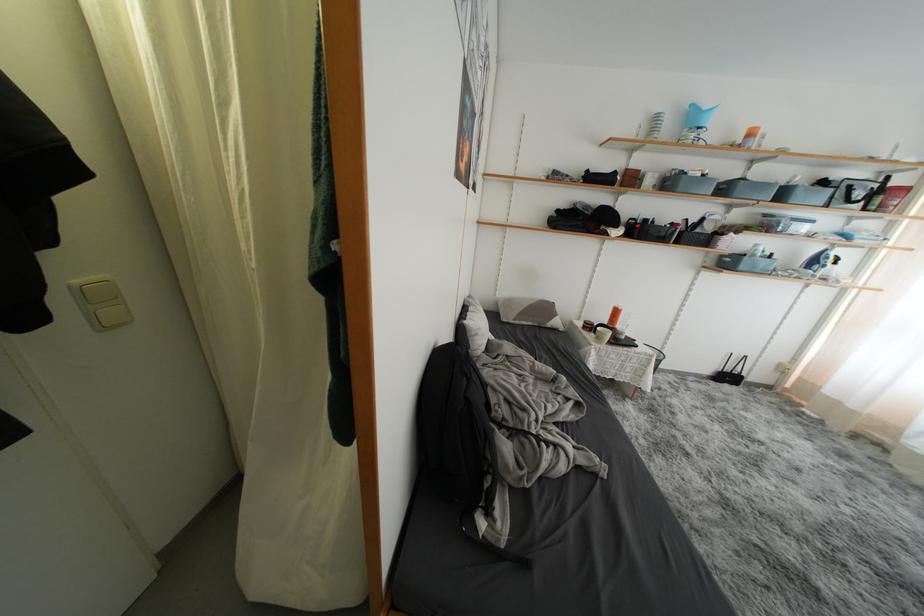
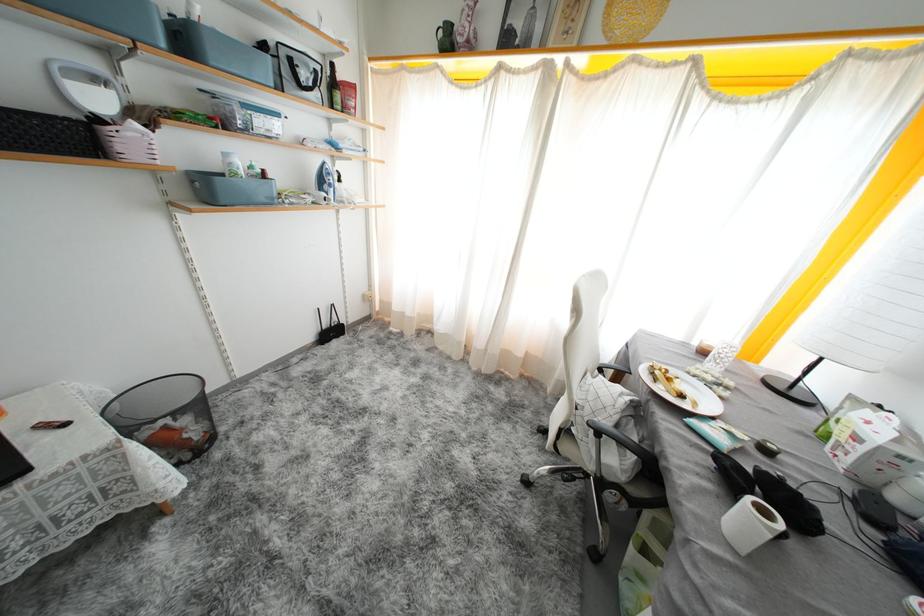
In the second image, find the point that corresponds to (735,267) in the first image.

(215, 196)